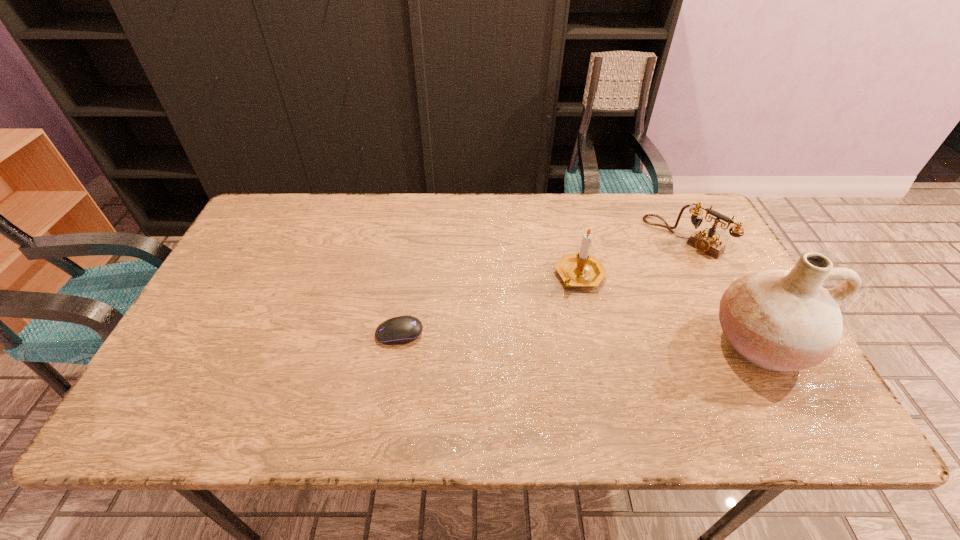
Identify the location of free space between the pottery and the shortest object. Image resolution: width=960 pixels, height=540 pixels. (580, 338).

At what (x,y) coordinates should I click in order to perform the action: click on vacant area that lies between the pottery and the shortest object. Please return your answer as a coordinate pair (x, y). The image size is (960, 540). Looking at the image, I should click on (580, 338).

Locate an element on the screen. The height and width of the screenshot is (540, 960). empty space that is in between the second tallest object and the pottery is located at coordinates (669, 309).

Find the location of a particular element. The image size is (960, 540). vacant space that is in between the candle holder and the pottery is located at coordinates coord(669,309).

At what (x,y) coordinates should I click in order to perform the action: click on free spot between the second shortest object and the leftmost object. Please return your answer as a coordinate pair (x, y). Looking at the image, I should click on pos(541,286).

Locate an element on the screen. vacant space in between the shortest object and the third object from right to left is located at coordinates (490, 305).

Locate an element on the screen. object that stands as the third closest to the third object from right to left is located at coordinates (404, 329).

This screenshot has height=540, width=960. What are the coordinates of `object that can be found as the closest to the candle holder` in the screenshot? It's located at point(708,243).

In order to click on free spot that satisfies the following two spatial constraints: 1. on the back side of the leftmost object; 2. on the left side of the telephone in this screenshot , I will do `click(415, 238)`.